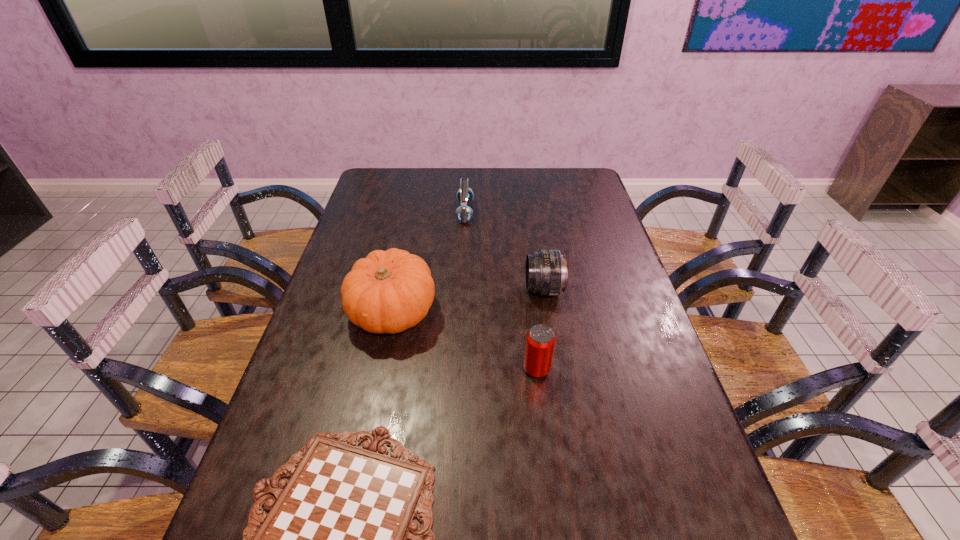
Locate an element on the screen. the tallest object is located at coordinates (389, 291).

What are the coordinates of `telephoto lens` in the screenshot? It's located at (546, 270).

The height and width of the screenshot is (540, 960). I want to click on the second nearest object, so click(540, 340).

The height and width of the screenshot is (540, 960). Find the location of `headset`. headset is located at coordinates (464, 213).

Locate an element on the screen. vacant region located 0.320m on the back of the pumpkin is located at coordinates (411, 221).

Where is `free spot located at the front element of the telephoto lens`? The image size is (960, 540). free spot located at the front element of the telephoto lens is located at coordinates (492, 290).

Where is `vacant space positioned 0.140m at the front element of the telephoto lens`? This screenshot has width=960, height=540. vacant space positioned 0.140m at the front element of the telephoto lens is located at coordinates (477, 290).

Identify the location of free point located 0.140m at the front element of the telephoto lens. The image size is (960, 540). (477, 290).

You are a GUI agent. You are given a task and a screenshot of the screen. Output one action in this format:
    pyautogui.click(x=<x>, y=<y>)
    Task: Click on the vacant space located on the back of the fourth farthest object
    
    Given the screenshot: What is the action you would take?
    pyautogui.click(x=529, y=302)

Identify the location of free space located on the ear cups of the farthest object. Image resolution: width=960 pixels, height=540 pixels. tap(567, 212).